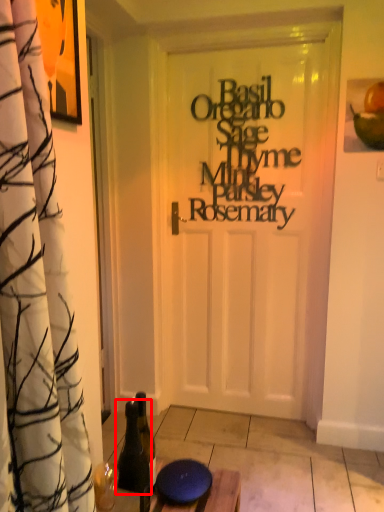
Question: Where is bottle (annotated by the red box) located in relation to writing in the image?

Choices:
 (A) left
 (B) right

Answer: (A)